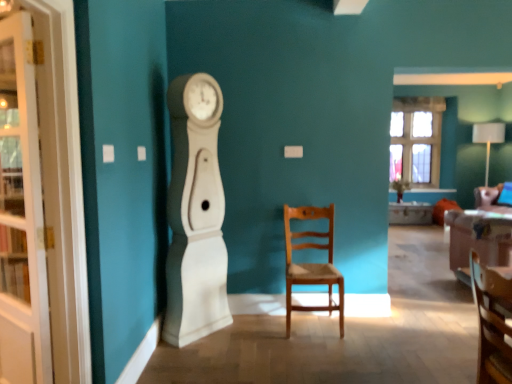
This screenshot has height=384, width=512. I want to click on wooden chair at center, which appears as the 1th chair when viewed from the back, so click(x=311, y=263).

Image resolution: width=512 pixels, height=384 pixels. What do you see at coordinates (195, 214) in the screenshot?
I see `white matte clock at left` at bounding box center [195, 214].

The image size is (512, 384). What are the coordinates of `clear glass window at upper right` in the screenshot? It's located at [416, 140].

The height and width of the screenshot is (384, 512). I want to click on wooden chair at center, which appears as the 1th chair when viewed from the back, so click(x=311, y=263).

From the image's perspective, which one is positioned higher, white glass cabinet at left or clear glass window at upper right?

clear glass window at upper right appears higher in the image.

Is white glass cabinet at left at the right side of clear glass window at upper right?

No, white glass cabinet at left is not to the right of clear glass window at upper right.

Is white glass cabinet at left looking in the opposite direction of clear glass window at upper right?

Yes, clear glass window at upper right is at the back of white glass cabinet at left.

Does white glass cabinet at left have a lesser width compared to clear glass window at upper right?

Yes, white glass cabinet at left is thinner than clear glass window at upper right.

Does velvet pink couch at right have a greater width compared to clear glass window at upper right?

Yes.

Which is behind, velvet pink couch at right or clear glass window at upper right?

Positioned behind is clear glass window at upper right.

What's the angular difference between velvet pink couch at right and clear glass window at upper right's facing directions?

The angle between the facing direction of velvet pink couch at right and the facing direction of clear glass window at upper right is 179 degrees.

Does velvet pink couch at right turn towards clear glass window at upper right?

Yes, velvet pink couch at right faces towards clear glass window at upper right.

From the image's perspective, between wooden chair at lower right, arranged as the 2th chair when viewed from the left, and velvet pink couch at right, who is located below?

wooden chair at lower right, arranged as the 2th chair when viewed from the left, from the image's perspective.

Based on the photo, from a real-world perspective, is wooden chair at lower right, positioned as the first chair in right-to-left order, on velvet pink couch at right?

Yes, from a real-world perspective, wooden chair at lower right, positioned as the first chair in right-to-left order, is above velvet pink couch at right.

How different are the orientations of wooden chair at lower right, which is the 1th chair from front to back, and velvet pink couch at right in degrees?

wooden chair at lower right, which is the 1th chair from front to back, and velvet pink couch at right are facing 89.1 degrees away from each other.

Considering the relative sizes of wooden chair at lower right, which is the 1th chair from front to back, and velvet pink couch at right in the image provided, is wooden chair at lower right, which is the 1th chair from front to back, shorter than velvet pink couch at right?

Yes.

From the image's perspective, which object appears higher, white matte clock at left or velvet pink couch at right?

white matte clock at left appears higher in the image.

Considering the sizes of white matte clock at left and velvet pink couch at right in the image, is white matte clock at left wider or thinner than velvet pink couch at right?

In the image, white matte clock at left appears to be more narrow than velvet pink couch at right.

Does white matte clock at left turn towards velvet pink couch at right?

No.

In the image, is white matte clock at left on the left side or the right side of velvet pink couch at right?

From the image, it's evident that white matte clock at left is to the left of velvet pink couch at right.

Choose the correct answer: Is velvet pink couch at right inside wooden chair at center, the 2th chair when ordered from front to back, or outside it?

velvet pink couch at right is spatially situated outside wooden chair at center, the 2th chair when ordered from front to back.

From the image's perspective, between velvet pink couch at right and wooden chair at center, marked as the first chair in a left-to-right arrangement, which one is located above?

wooden chair at center, marked as the first chair in a left-to-right arrangement, is shown above in the image.

Is velvet pink couch at right taller than wooden chair at center, marked as the first chair in a left-to-right arrangement?

No.

Considering the positions of point (460, 245) and point (341, 274), is point (460, 245) closer or farther from the camera than point (341, 274)?

Point (460, 245) is farther from the camera than point (341, 274).

Between white glossy desk at center and white glass cabinet at left, which one has more height?

Standing taller between the two is white glass cabinet at left.

Is the position of white glossy desk at center more distant than that of white glass cabinet at left?

Yes, it is.

Visually, is white glossy desk at center positioned to the left or to the right of white glass cabinet at left?

white glossy desk at center is to the right of white glass cabinet at left.

Is the surface of white glossy desk at center in direct contact with clear glass window at upper right?

They are not placed beside each other.

Considering the sizes of objects white glossy desk at center and clear glass window at upper right in the image provided, who is wider, white glossy desk at center or clear glass window at upper right?

Result: With larger width is white glossy desk at center.

Could you tell me if white glossy desk at center is turned towards clear glass window at upper right?

No.

Is white glossy desk at center inside the boundaries of clear glass window at upper right, or outside?

white glossy desk at center cannot be found inside clear glass window at upper right.

At what (x,y) coordinates should I click in order to perform the action: click on window lying above the white glass cabinet at left (from the image's perspective). Please return your answer as a coordinate pair (x, y). The width and height of the screenshot is (512, 384). Looking at the image, I should click on (416, 140).

The image size is (512, 384). What are the coordinates of `studio couch below the clear glass window at upper right (from the image's perspective)` in the screenshot? It's located at (478, 239).

Based on their spatial positions, is clear glass window at upper right or white glass cabinet at left closer to wooden chair at center, which is the second chair from right to left?

white glass cabinet at left is positioned closer to the anchor wooden chair at center, which is the second chair from right to left.

From the image, which object appears to be nearer to wooden chair at lower right, positioned as the first chair in right-to-left order, velvet pink couch at right or white glossy desk at center?

velvet pink couch at right is positioned closer to the anchor wooden chair at lower right, positioned as the first chair in right-to-left order.

Based on the photo, from the image, which object appears to be farther from white matte clock at left, wooden chair at lower right, which is the 2th chair from back to front, or wooden chair at center, the 2th chair when ordered from front to back?

Among the two, wooden chair at lower right, which is the 2th chair from back to front, is located further to white matte clock at left.

Considering their positions, is white matte clock at left positioned closer to wooden chair at lower right, which is the 2th chair from back to front, than wooden chair at center, which is the second chair from right to left?

wooden chair at center, which is the second chair from right to left.

When comparing their distances from white glass cabinet at left, does wooden chair at center, which appears as the 1th chair when viewed from the back, or white matte clock at left seem closer?

white matte clock at left is positioned closer to the anchor white glass cabinet at left.

Based on their spatial positions, is white glossy desk at center or white glass cabinet at left further from white matte clock at left?

The object further to white matte clock at left is white glossy desk at center.

Based on the photo, considering their positions, is velvet pink couch at right positioned closer to white matte clock at left than wooden chair at lower right, positioned as the first chair in right-to-left order?

wooden chair at lower right, positioned as the first chair in right-to-left order, is closer to white matte clock at left.

When comparing their distances from velvet pink couch at right, does white matte clock at left or white glass cabinet at left seem closer?

white matte clock at left is positioned closer to the anchor velvet pink couch at right.

Find the location of a particular element. This screenshot has width=512, height=384. studio couch between wooden chair at center, which appears as the 1th chair when viewed from the back, and clear glass window at upper right in the front-back direction is located at coordinates (478, 239).

At what (x,y) coordinates should I click in order to perform the action: click on cabinetry located between wooden chair at lower right, positioned as the first chair in right-to-left order, and white glossy desk at center in the depth direction. Please return your answer as a coordinate pair (x, y). The height and width of the screenshot is (384, 512). Looking at the image, I should click on (21, 212).

The width and height of the screenshot is (512, 384). I want to click on chair between white glass cabinet at left and clear glass window at upper right in the front-back direction, so click(x=311, y=263).

Where is `clock located between white glass cabinet at left and wooden chair at center, which is the second chair from right to left, in the left-right direction`? clock located between white glass cabinet at left and wooden chair at center, which is the second chair from right to left, in the left-right direction is located at coordinates (195, 214).